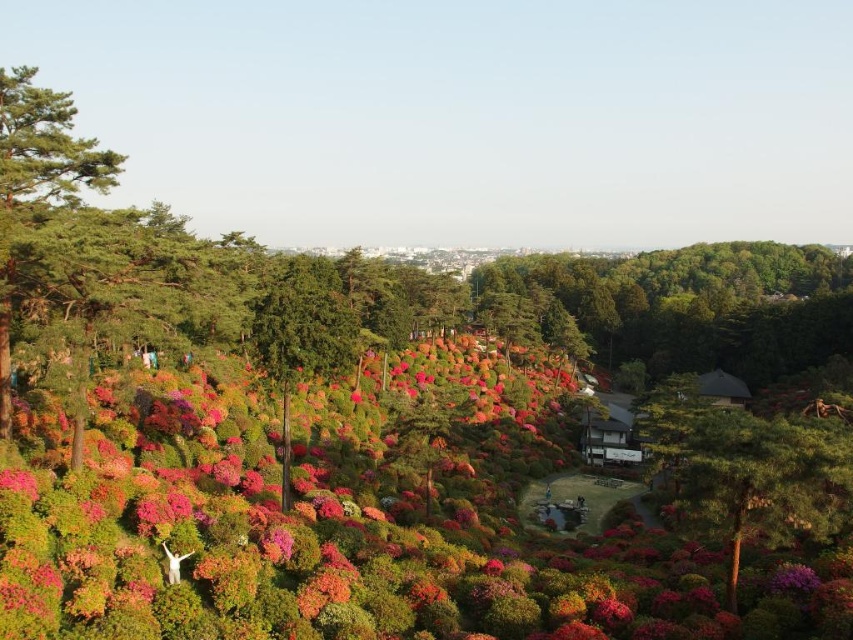
You are planning to plant a new tree in your garden. You have two options based on the image provided. The first option is the green rough bark tree at left, and the second is the green matte tree at center. If you want a wider tree for shade, which one should you choose?

The green matte tree at center is wider than the green rough bark tree at left, so you should choose the green matte tree at center for a wider shade.